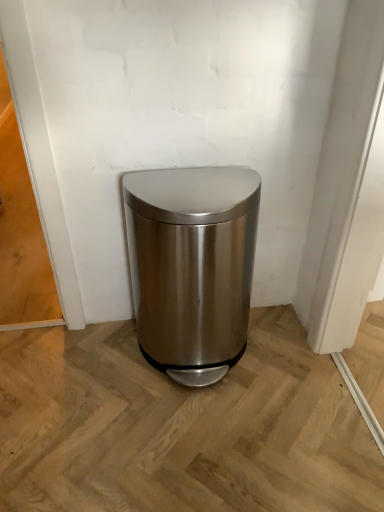
The height and width of the screenshot is (512, 384). I want to click on satin metallic trash can at center, so click(192, 266).

Describe the element at coordinates (192, 266) in the screenshot. I see `satin metallic trash can at center` at that location.

Locate an element on the screen. The image size is (384, 512). satin metallic trash can at center is located at coordinates (192, 266).